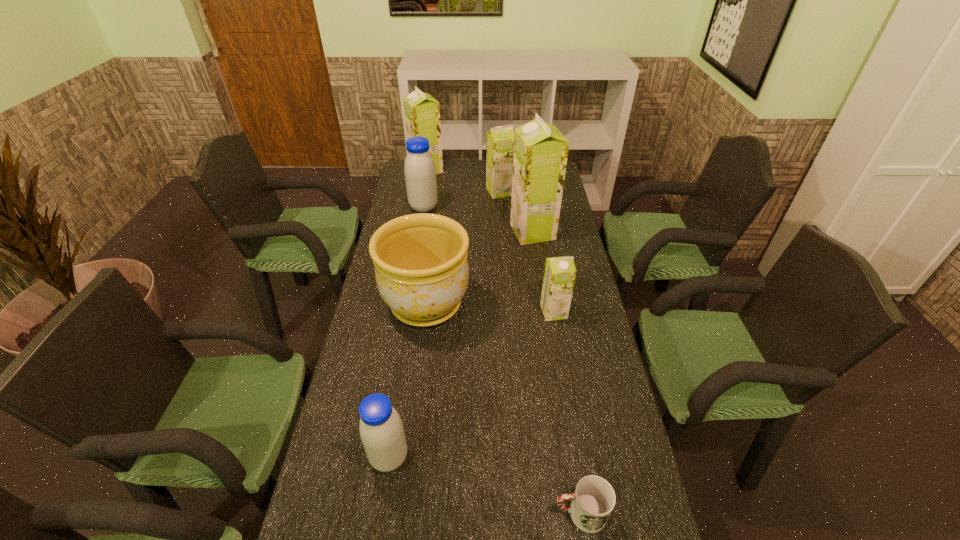
Where is `blank area located 0.180m on the back of the nearest green soya milk`? The width and height of the screenshot is (960, 540). blank area located 0.180m on the back of the nearest green soya milk is located at coordinates (546, 267).

You are a GUI agent. You are given a task and a screenshot of the screen. Output one action in this format:
    pyautogui.click(x=<x>, y=<y>)
    Task: Click on the vacant position located 0.090m on the back of the seventh farthest object
    Image resolution: width=960 pixels, height=540 pixels.
    Given the screenshot: What is the action you would take?
    pyautogui.click(x=397, y=407)

This screenshot has width=960, height=540. I want to click on vacant space located 0.120m on the side of the shortest object where the handle is located, so click(499, 513).

At what (x,y) coordinates should I click in order to perform the action: click on vacant space located on the side of the shortest object where the handle is located. Please return your answer as a coordinate pair (x, y). Looking at the image, I should click on (431, 513).

I want to click on free space located on the side of the shortest object where the handle is located, so click(386, 513).

The height and width of the screenshot is (540, 960). In order to click on flowerpot positioned at the left edge in this screenshot , I will do `click(421, 267)`.

This screenshot has width=960, height=540. I want to click on cup present at the right edge, so click(x=592, y=503).

Where is `object that is at the far left corner`? object that is at the far left corner is located at coordinates (422, 113).

In the image, there is a desktop. Where is `free region at the far edge`? This screenshot has width=960, height=540. free region at the far edge is located at coordinates (470, 173).

In the image, there is a desktop. Identify the location of vacant space at the left edge. Image resolution: width=960 pixels, height=540 pixels. (405, 374).